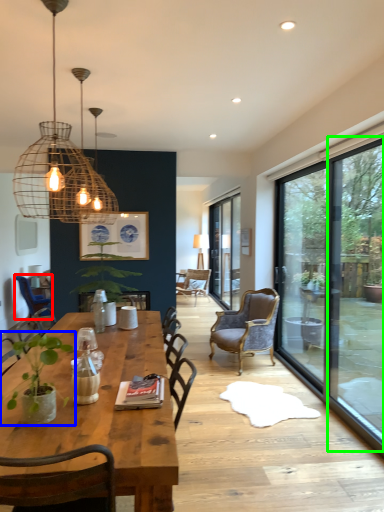
Question: Considering the real-world distances, which object is closest to chair (highlighted by a red box)? houseplant (highlighted by a blue box) or window screen (highlighted by a green box).

Choices:
 (A) houseplant
 (B) window screen

Answer: (A)